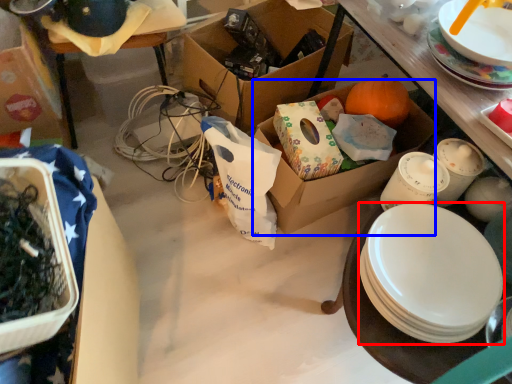
Question: Among these objects, which one is farthest to the camera, plate (highlighted by a red box) or box (highlighted by a blue box)?

Choices:
 (A) plate
 (B) box

Answer: (B)